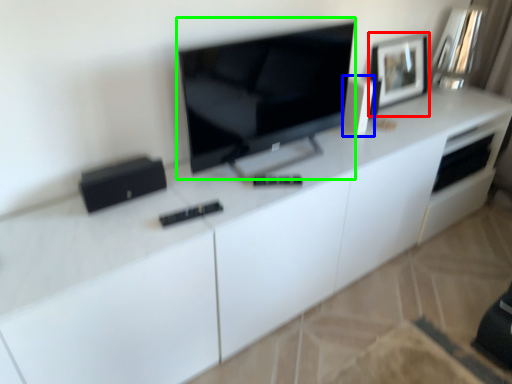
Question: Which object is positioned closest to picture frame (highlighted by a red box)? Select from appliance (highlighted by a blue box) and television (highlighted by a green box).

Choices:
 (A) appliance
 (B) television

Answer: (A)